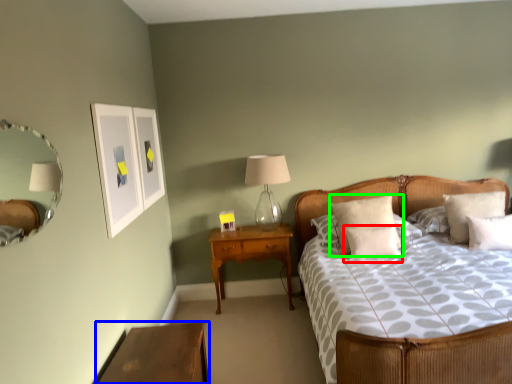
Question: Which object is the farthest from pillow (highlighted by a red box)? Choose among these: nightstand (highlighted by a blue box) or pillow (highlighted by a green box).

Choices:
 (A) nightstand
 (B) pillow

Answer: (A)